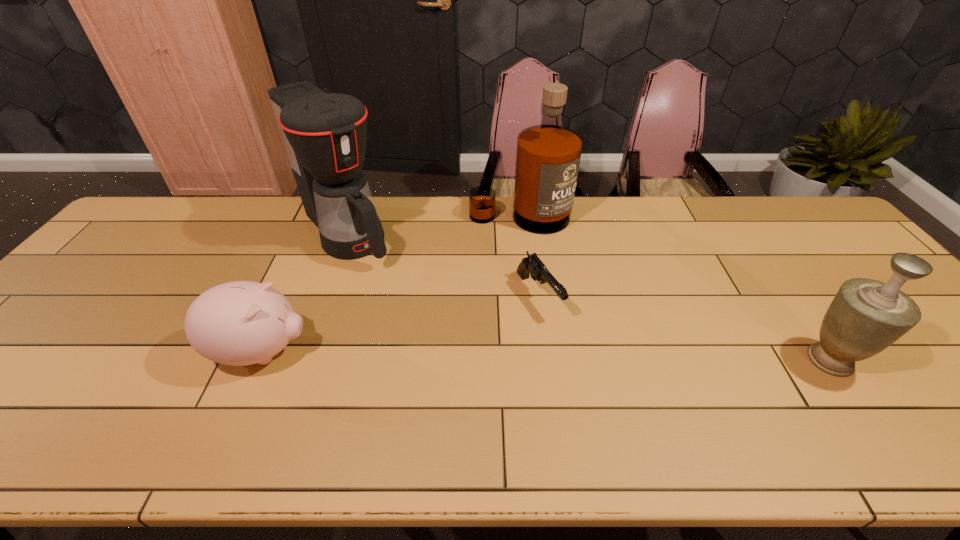
Image resolution: width=960 pixels, height=540 pixels. In order to click on free space located pour from the carafe of the coffee maker in this screenshot , I will do `click(400, 296)`.

Where is `free region located 0.270m on the front label of the liquor`? free region located 0.270m on the front label of the liquor is located at coordinates (541, 296).

Locate an element on the screen. The height and width of the screenshot is (540, 960). vacant space located 0.050m on the front label of the liquor is located at coordinates (528, 245).

The width and height of the screenshot is (960, 540). I want to click on blank area located on the front label of the liquor, so click(530, 251).

Find the location of a particular element. free spot located at the end of the barrel of the gun is located at coordinates (573, 351).

Locate an element on the screen. The height and width of the screenshot is (540, 960). free space located 0.150m at the end of the barrel of the gun is located at coordinates (586, 367).

Identify the location of vacant region located 0.170m at the end of the barrel of the gun. Image resolution: width=960 pixels, height=540 pixels. (590, 373).

The image size is (960, 540). In order to click on coffee maker that is positioned at the far edge in this screenshot , I will do `click(324, 134)`.

You are a GUI agent. You are given a task and a screenshot of the screen. Output one action in this format:
    pyautogui.click(x=<x>, y=<y>)
    Task: Click on the liquor at the far edge
    The height and width of the screenshot is (540, 960).
    Given the screenshot: What is the action you would take?
    pyautogui.click(x=548, y=155)

At what (x,y) coordinates should I click in order to perform the action: click on piggy bank located at the near edge. Please return your answer as a coordinate pair (x, y). The image size is (960, 540). Looking at the image, I should click on pos(238,323).